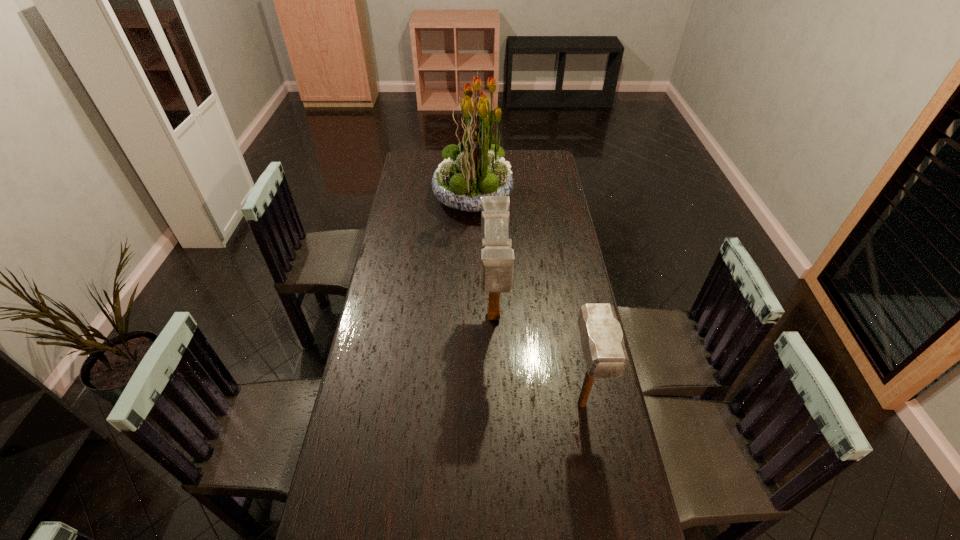
At what (x,y) coordinates should I click in order to perform the action: click on object that is at the right edge. Please return your answer as a coordinate pair (x, y). This screenshot has height=540, width=960. Looking at the image, I should click on (602, 341).

The width and height of the screenshot is (960, 540). I want to click on vacant space at the left edge of the desktop, so click(398, 325).

This screenshot has width=960, height=540. Identify the location of free space at the right edge of the desktop. (544, 220).

Where is `free point between the shorter mallet and the flower arrangement`? The width and height of the screenshot is (960, 540). free point between the shorter mallet and the flower arrangement is located at coordinates (527, 300).

Identify the location of free area in between the nearer mallet and the flower arrangement. (527, 300).

The width and height of the screenshot is (960, 540). In order to click on vacant area between the farthest object and the nearest object in this screenshot , I will do `click(527, 300)`.

Identify which object is the nearest to the nearest object. Please provide its 2D coordinates. Your answer should be formatted as a tuple, i.e. [(x, y)], where the tuple contains the x and y coordinates of a point satisfying the conditions above.

[(497, 258)]

Find the location of a particular element. object that stands as the closest to the rightmost object is located at coordinates (497, 258).

Locate an element on the screen. vacant region that satisfies the following two spatial constraints: 1. on the back side of the farther mallet; 2. on the front-facing side of the flower arrangement is located at coordinates (490, 195).